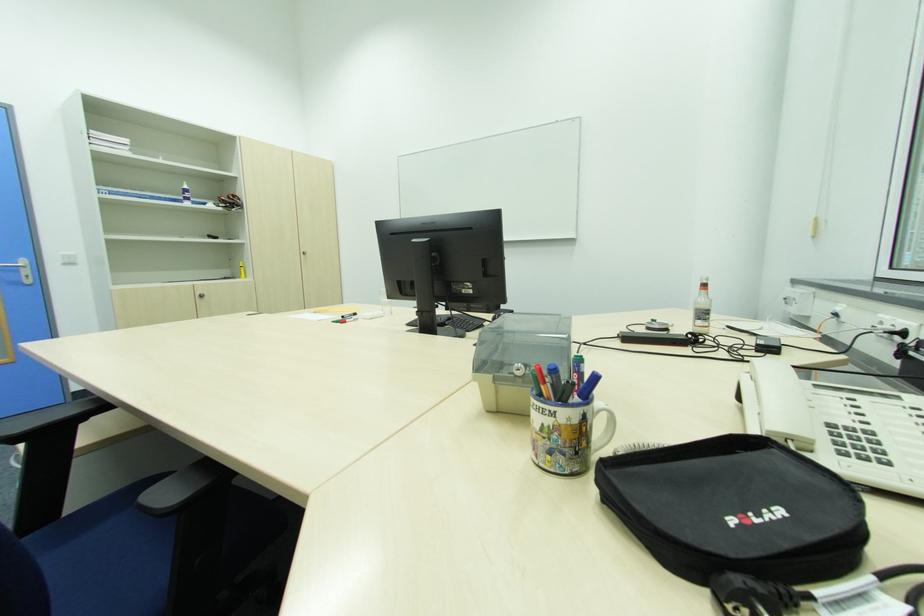
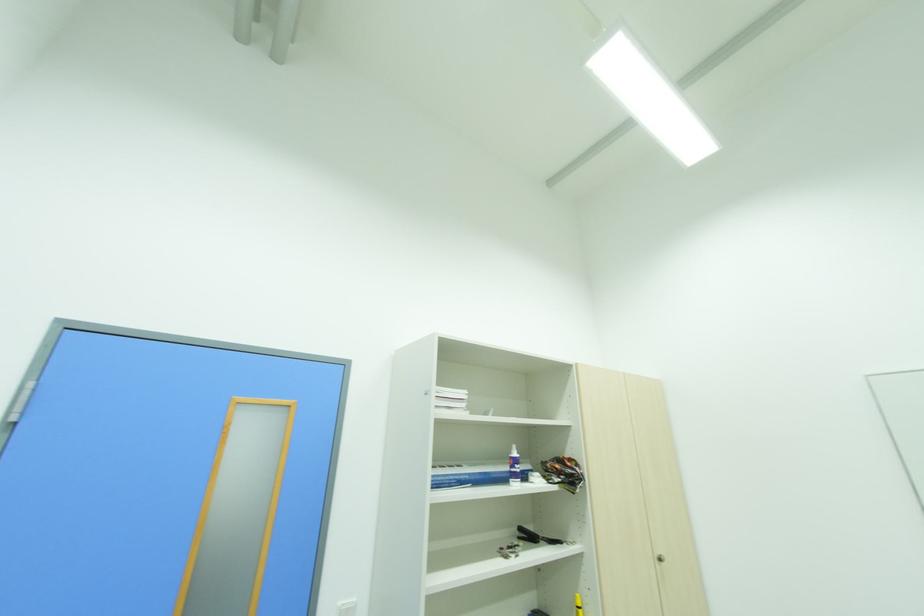
Where in the second image is the point corresponding to [217,238] from the first image?

(536, 539)